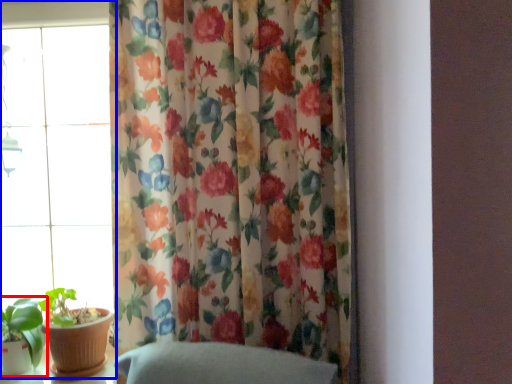
Question: Among these objects, which one is nearest to the camera, houseplant (highlighted by a red box) or window (highlighted by a blue box)?

Choices:
 (A) houseplant
 (B) window

Answer: (A)